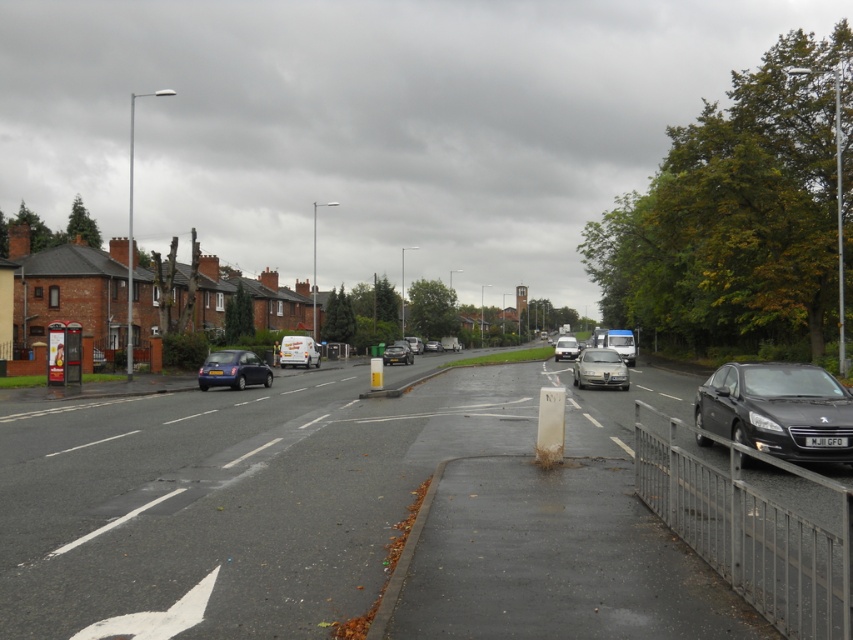
You are a pedestrian standing at the bus stop with a red and black design. You want to cross the road to the lamppost beside the bus stop. However, there are two vehicles in your path. Can you safely cross between the shiny black sedan at center and the silver metallic van at center?

The shiny black sedan at center is positioned under the silver metallic van at center, which means they are stacked vertically. Since you are a pedestrian at the bus stop, the vehicles are likely parked or stopped in a line, so you can safely cross between them as there is no horizontal obstruction.

You are a delivery driver trying to park your vehicle in a narrow alley that can only accommodate vehicles up to 2 meters in width. You see a white matte van at center and a silver metallic van at center in the image. Which van would fit better in the alley?

The white matte van at center is thinner than the silver metallic van at center, so it would fit better in the narrow alley since it is narrower than the 2 meters width limit.